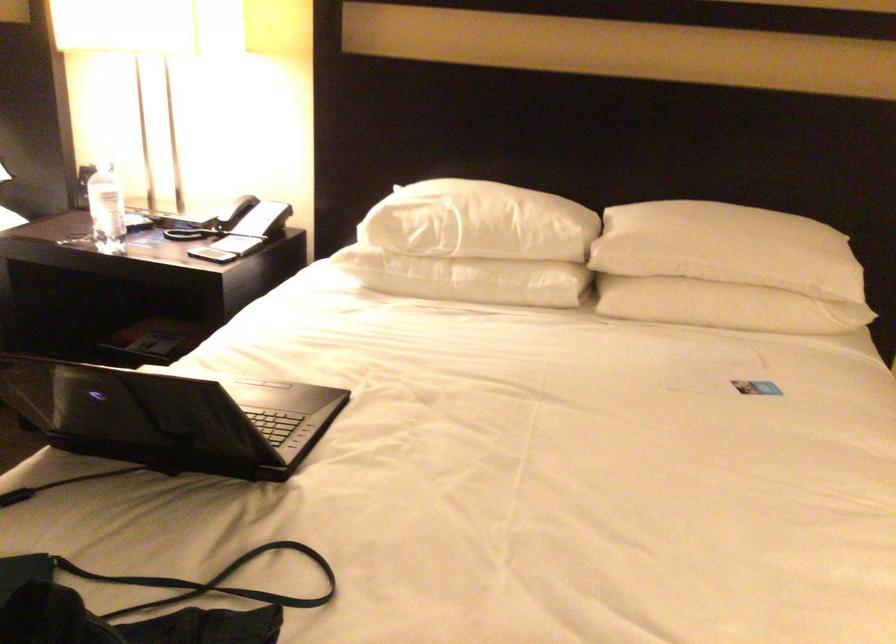
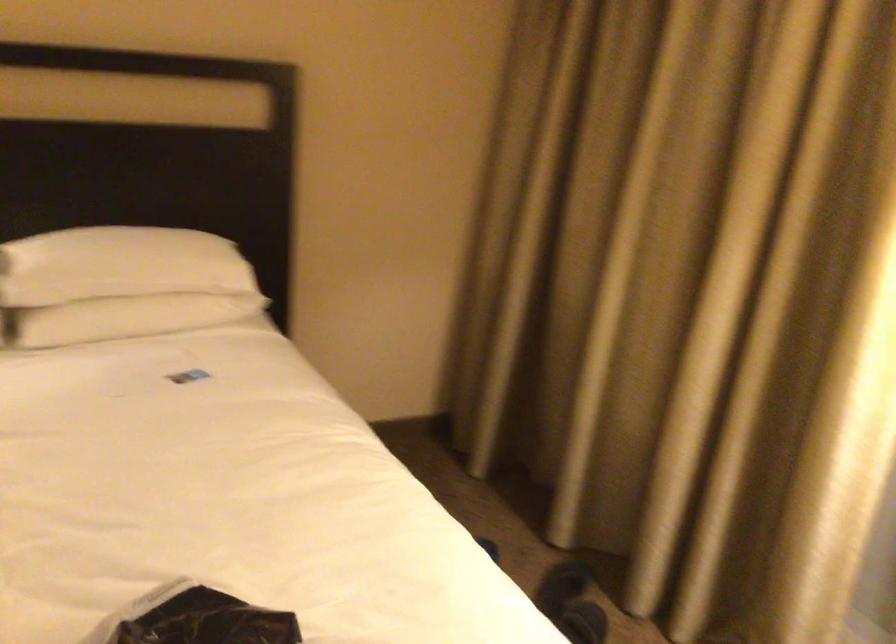
Question: The first image is from the beginning of the video and the second image is from the end. How did the camera likely rotate when shooting the video?

Choices:
 (A) Left
 (B) Right
 (C) Up
 (D) Down

Answer: (B)